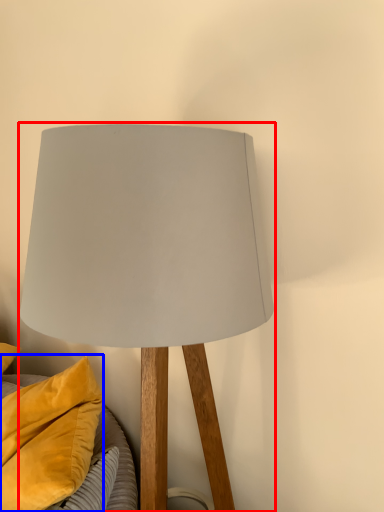
Question: Among these objects, which one is farthest to the camera, lamp (highlighted by a red box) or pillow (highlighted by a blue box)?

Choices:
 (A) lamp
 (B) pillow

Answer: (B)